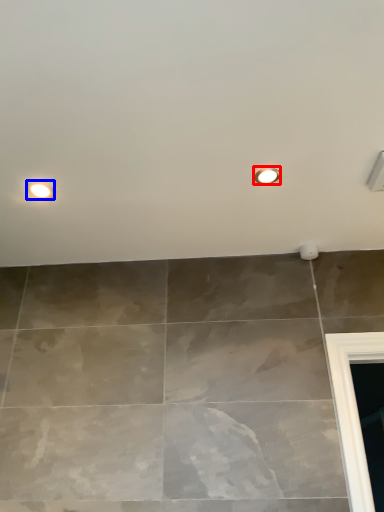
Question: Which point is further to the camera, droplight (highlighted by a red box) or droplight (highlighted by a blue box)?

Choices:
 (A) droplight
 (B) droplight

Answer: (B)